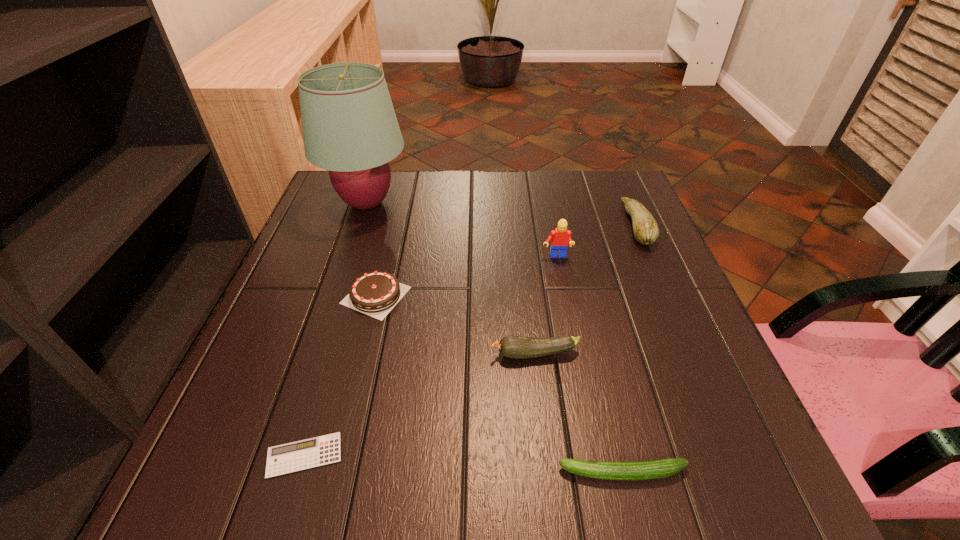
The width and height of the screenshot is (960, 540). In order to click on vacant area at the far right corner of the desktop in this screenshot , I will do `click(618, 185)`.

Find the location of a particular element. The width and height of the screenshot is (960, 540). vacant space at the near right corner of the desktop is located at coordinates (702, 466).

Find the location of a particular element. This screenshot has width=960, height=540. free spot between the third tallest object and the shortest object is located at coordinates (470, 340).

Where is `free space between the nearest zucchini and the tallest object`? free space between the nearest zucchini and the tallest object is located at coordinates (495, 338).

Locate an element on the screen. This screenshot has width=960, height=540. free point between the fifth nearest object and the rightmost object is located at coordinates (596, 241).

Find the location of a particular element. vacant point located between the shortest object and the chocolate cake is located at coordinates (340, 375).

This screenshot has width=960, height=540. I want to click on empty location between the shortest object and the fifth farthest object, so click(420, 404).

Identify the location of vacant area that lies between the second tallest zucchini and the rightmost object. The height and width of the screenshot is (540, 960). (586, 289).

At what (x,y) coordinates should I click in order to perform the action: click on unoccupied position between the fifth farthest object and the tallest object. Please return your answer as a coordinate pair (x, y). This screenshot has width=960, height=540. Looking at the image, I should click on (451, 279).

Identify the location of empty space that is in between the sixth shortest object and the tallest object. (462, 230).